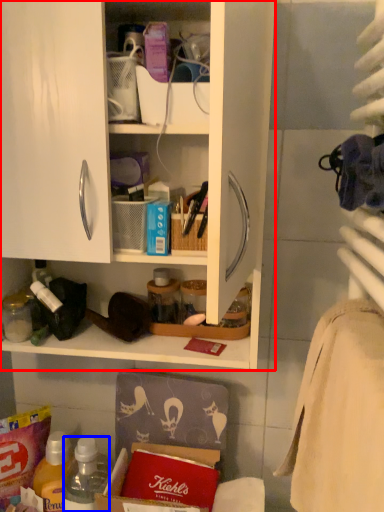
Question: Which of the following is the farthest to the observer, cabinetry (highlighted by a red box) or bottle (highlighted by a blue box)?

Choices:
 (A) cabinetry
 (B) bottle

Answer: (B)